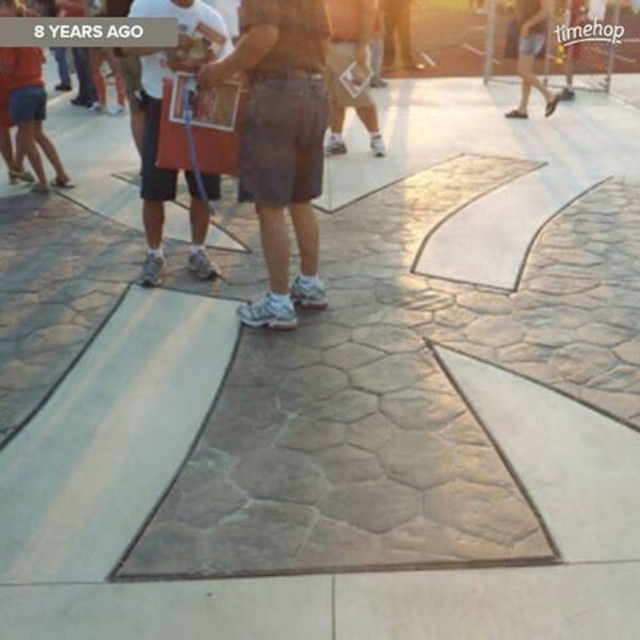
Looking at this image, you are standing at the baseball diamond and want to take a photo of both point [280,282] and point [352,56]. Which point should you focus on first to ensure both are in clear view?

You should focus on point [280,282] first because it is closer to the camera than point [352,56], ensuring both points are in focus.

Consider the image. You are at a baseball game and need to find a seat. You see the brown textured shorts at center and the white denim shorts at upper right. Which pair of shorts is shorter?

The brown textured shorts at center is shorter than the white denim shorts at upper right.